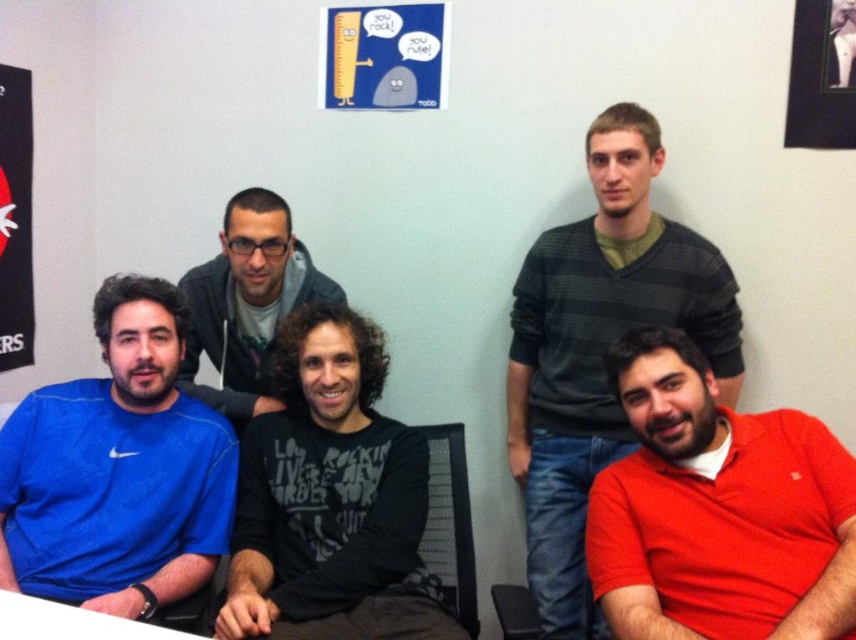
Measure the distance between point (x=282, y=321) and camera.

They are 1.86 meters apart.

I want to click on black matte shirt at center, so click(331, 499).

Between point (628, 604) and point (209, 326), which one is positioned in front?

Point (628, 604) is more forward.

Does point (788, 426) come farther from viewer compared to point (230, 211)?

No.

Is point (736, 461) farther from camera compared to point (236, 262)?

No, it is in front of (236, 262).

Locate an element on the screen. red matte shirt at lower right is located at coordinates (718, 512).

Can you confirm if green striped sweater at upper right is smaller than black fabric poster at upper left?

Incorrect, green striped sweater at upper right is not smaller in size than black fabric poster at upper left.

Does green striped sweater at upper right have a greater height compared to black fabric poster at upper left?

Indeed, green striped sweater at upper right has a greater height compared to black fabric poster at upper left.

Find the location of a particular element. green striped sweater at upper right is located at coordinates (599, 349).